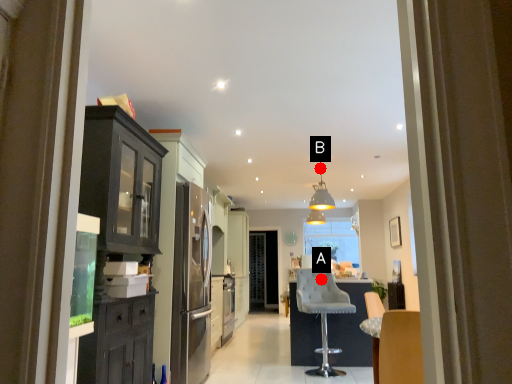
Question: Two points are circled on the image, labeled by A and B beside each circle. Which point is farther from the camera taking this photo?

Choices:
 (A) A is further
 (B) B is further

Answer: (B)